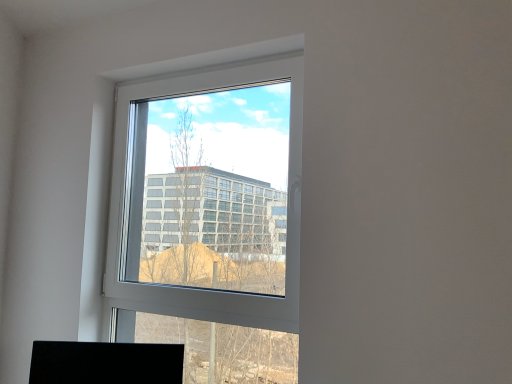
Where is `black matte desktop at lower left`? The height and width of the screenshot is (384, 512). black matte desktop at lower left is located at coordinates (106, 363).

Describe the element at coordinates (106, 363) in the screenshot. The image size is (512, 384). I see `black matte desktop at lower left` at that location.

Locate an element on the screen. The height and width of the screenshot is (384, 512). white plastic window at center is located at coordinates (210, 217).

What do you see at coordinates (210, 217) in the screenshot? I see `white plastic window at center` at bounding box center [210, 217].

This screenshot has width=512, height=384. In order to click on black matte desktop at lower left in this screenshot , I will do `click(106, 363)`.

Which is more to the left, white plastic window at center or black matte desktop at lower left?

From the viewer's perspective, black matte desktop at lower left appears more on the left side.

Relative to black matte desktop at lower left, is white plastic window at center in front or behind?

In the image, white plastic window at center appears in front of black matte desktop at lower left.

Between point (264, 138) and point (180, 363), which one is positioned in front?

The point (180, 363) is in front.

From the image's perspective, relative to black matte desktop at lower left, is white plastic window at center above or below?

white plastic window at center is above black matte desktop at lower left.

From a real-world perspective, is white plastic window at center positioned above or below black matte desktop at lower left?

In terms of real-world spatial position, white plastic window at center is above black matte desktop at lower left.

Considering the sizes of white plastic window at center and black matte desktop at lower left in the image, is white plastic window at center wider or thinner than black matte desktop at lower left?

Clearly, white plastic window at center has less width compared to black matte desktop at lower left.

Between white plastic window at center and black matte desktop at lower left, which one has less height?

black matte desktop at lower left.

Can you confirm if white plastic window at center is smaller than black matte desktop at lower left?

Incorrect, white plastic window at center is not smaller in size than black matte desktop at lower left.

Is black matte desktop at lower left completely or partially inside white plastic window at center?

Definitely not — black matte desktop at lower left is not inside white plastic window at center.

Would you consider white plastic window at center to be distant from black matte desktop at lower left?

No, white plastic window at center is in close proximity to black matte desktop at lower left.

Is white plastic window at center facing away from black matte desktop at lower left?

No, black matte desktop at lower left is not at the back of white plastic window at center.

Can you tell me how much white plastic window at center and black matte desktop at lower left differ in facing direction?

31.6 degrees.

How much distance is there between white plastic window at center and black matte desktop at lower left?

white plastic window at center and black matte desktop at lower left are 37.33 inches apart.

Image resolution: width=512 pixels, height=384 pixels. Identify the location of desktop on the left of white plastic window at center. (106, 363).

Considering the relative positions of black matte desktop at lower left and white plastic window at center in the image provided, is black matte desktop at lower left to the left of white plastic window at center from the viewer's perspective?

Indeed, black matte desktop at lower left is positioned on the left side of white plastic window at center.

Considering the relative positions of black matte desktop at lower left and white plastic window at center in the image provided, is black matte desktop at lower left behind white plastic window at center?

That is True.

Which is nearer, (117, 366) or (184, 301)?

Positioned in front is point (117, 366).

From the image's perspective, does black matte desktop at lower left appear lower than white plastic window at center?

Yes.

From a real-world perspective, is black matte desktop at lower left under white plastic window at center?

Correct, in the physical world, black matte desktop at lower left is lower than white plastic window at center.

Considering the sizes of black matte desktop at lower left and white plastic window at center in the image, is black matte desktop at lower left wider or thinner than white plastic window at center?

black matte desktop at lower left is wider than white plastic window at center.

Consider the image. Which of these two, black matte desktop at lower left or white plastic window at center, stands taller?

Standing taller between the two is white plastic window at center.

Between black matte desktop at lower left and white plastic window at center, which one has smaller size?

Smaller between the two is black matte desktop at lower left.

Based on the photo, is white plastic window at center located within black matte desktop at lower left?

No, white plastic window at center is located outside of black matte desktop at lower left.

Is the surface of black matte desktop at lower left in direct contact with white plastic window at center?

black matte desktop at lower left and white plastic window at center are not in contact.

Does black matte desktop at lower left turn towards white plastic window at center?

No.

How many degrees apart are the facing directions of black matte desktop at lower left and white plastic window at center?

They differ by 31.6 degrees in their facing directions.

Image resolution: width=512 pixels, height=384 pixels. What are the coordinates of `window above the black matte desktop at lower left (from the image's perspective)` in the screenshot? It's located at (210, 217).

What are the coordinates of `window located above the black matte desktop at lower left (from a real-world perspective)` in the screenshot? It's located at (210, 217).

Where is `window above the black matte desktop at lower left (from the image's perspective)`? This screenshot has height=384, width=512. window above the black matte desktop at lower left (from the image's perspective) is located at coordinates (210, 217).